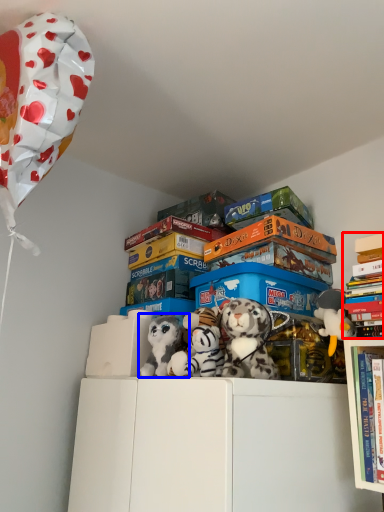
Question: Which point is closer to the camera, book (highlighted by a red box) or toy (highlighted by a blue box)?

Choices:
 (A) book
 (B) toy

Answer: (A)